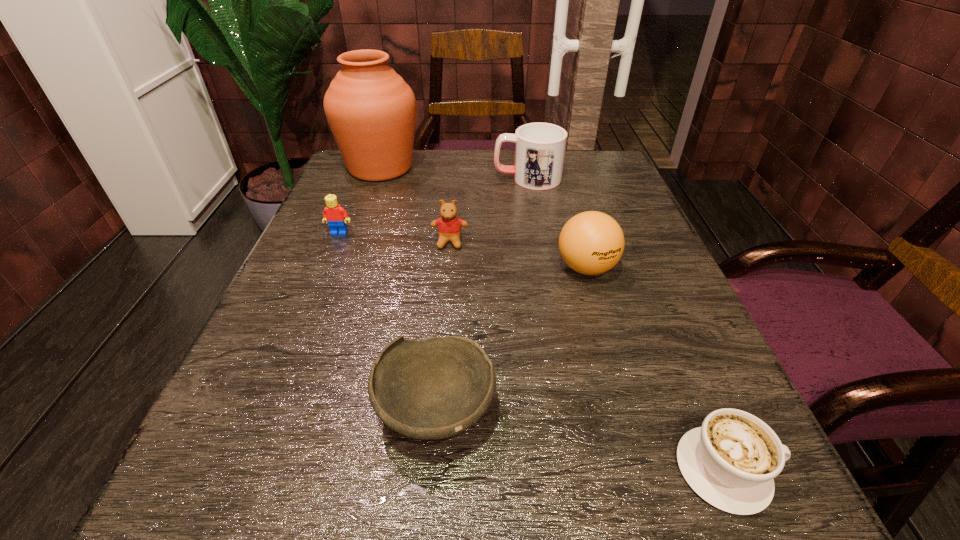
Locate an element on the screen. mug located at the right edge is located at coordinates (540, 148).

Where is `ping-pong ball that is positioned at the right edge`? The width and height of the screenshot is (960, 540). ping-pong ball that is positioned at the right edge is located at coordinates (x=591, y=243).

Identify the location of cappuccino positioned at the right edge. The width and height of the screenshot is (960, 540). (731, 461).

In order to click on object present at the far left corner in this screenshot , I will do `click(371, 111)`.

Find the location of `object that is at the far right corner`. object that is at the far right corner is located at coordinates (540, 148).

Find the location of `object situated at the near right corner`. object situated at the near right corner is located at coordinates (731, 461).

The height and width of the screenshot is (540, 960). I want to click on free region at the far edge of the desktop, so click(476, 162).

You are a GUI agent. You are given a task and a screenshot of the screen. Output one action in this format:
    pyautogui.click(x=<x>, y=<y>)
    Task: Click on the vacant space at the near edge of the desktop
    The image size is (960, 540).
    Given the screenshot: What is the action you would take?
    pyautogui.click(x=351, y=500)

The image size is (960, 540). I want to click on vacant space at the left edge, so click(x=307, y=338).

At what (x,y) coordinates should I click in order to perform the action: click on vacant space at the right edge. Please return your answer as a coordinate pair (x, y). This screenshot has width=960, height=540. Looking at the image, I should click on (609, 201).